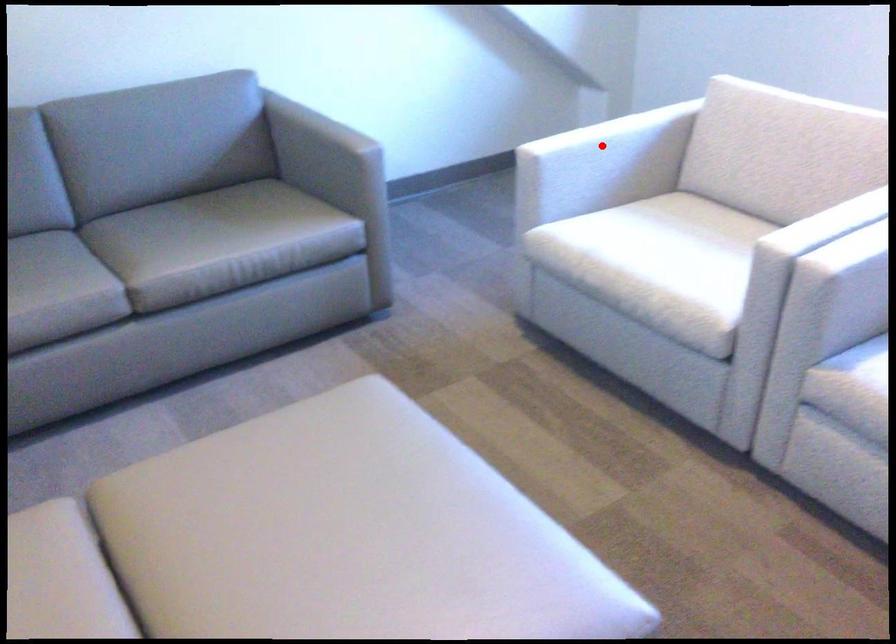
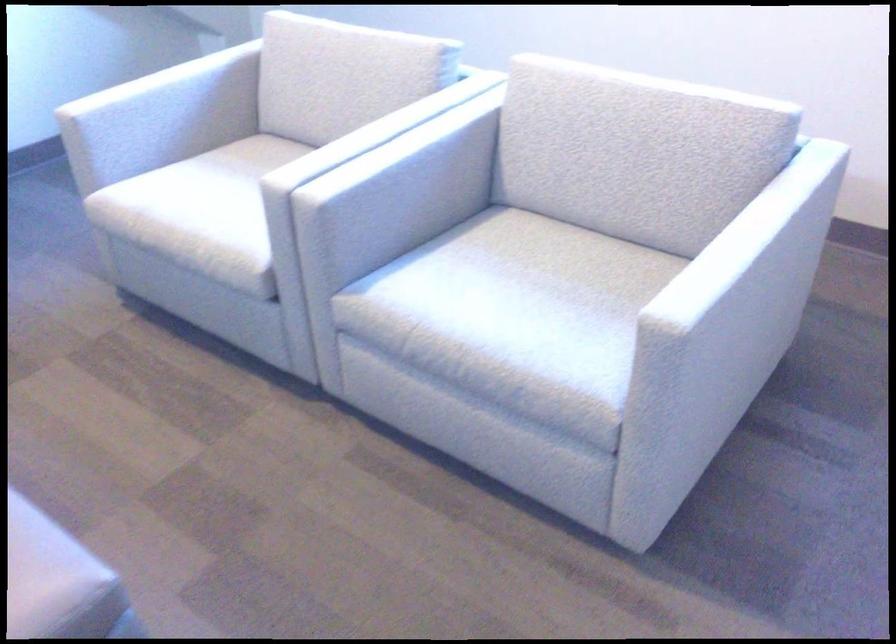
Where in the second image is the point corresponding to the highlighted location from the first image?

(150, 96)